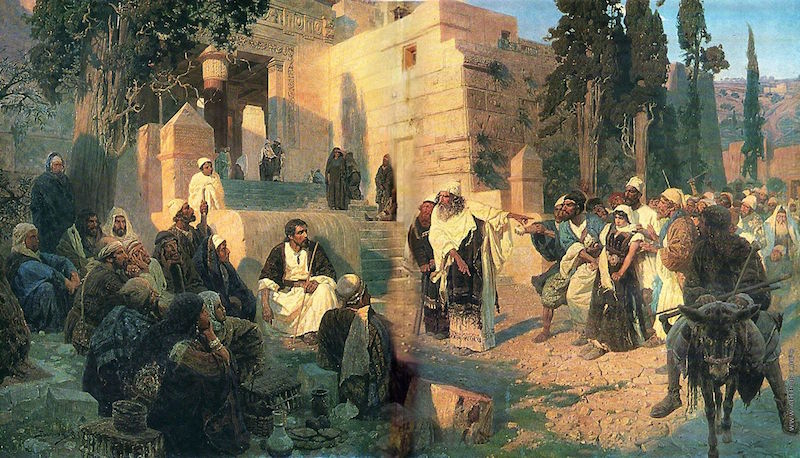
Where is `columns`? columns is located at coordinates (521, 187), (182, 153), (273, 97), (230, 128), (162, 111).